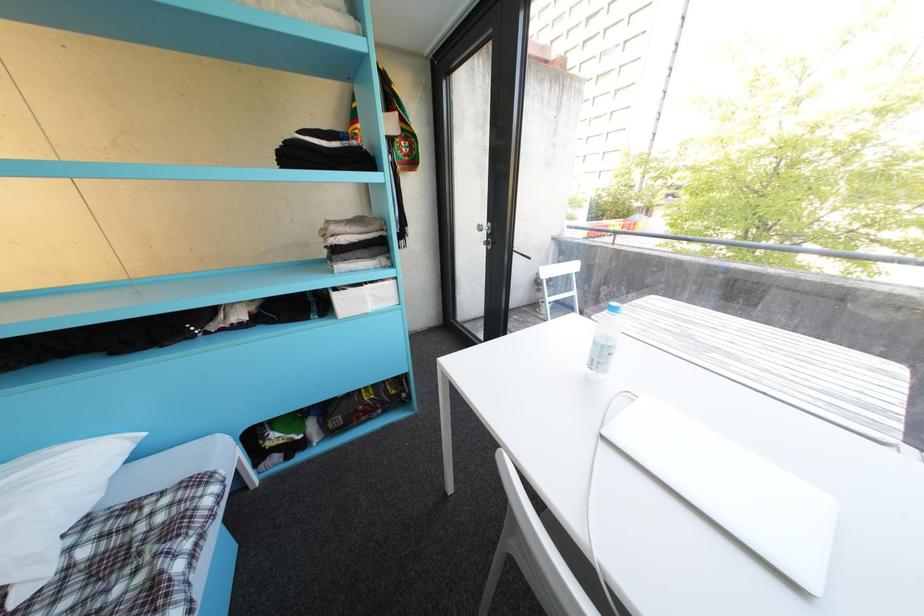
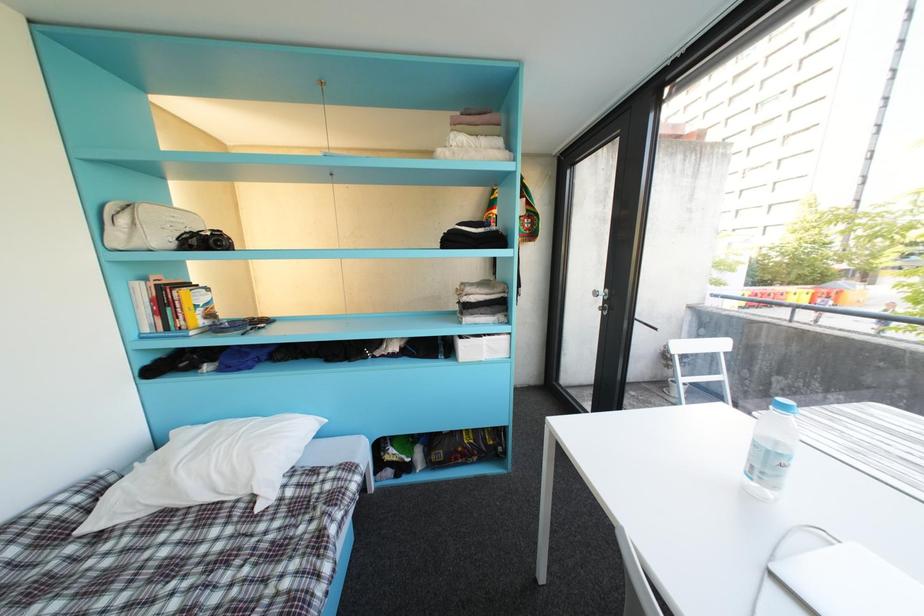
Question: The images are taken continuously from a first-person perspective. In which direction is your viewpoint rotating?

Choices:
 (A) Left
 (B) Right
 (C) Up
 (D) Down

Answer: (A)